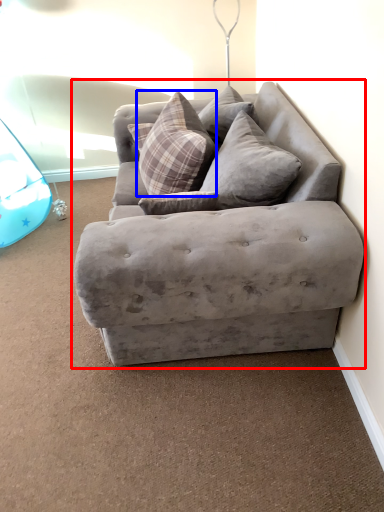
Question: Which of the following is the farthest to the observer, studio couch (highlighted by a red box) or pillow (highlighted by a blue box)?

Choices:
 (A) studio couch
 (B) pillow

Answer: (B)